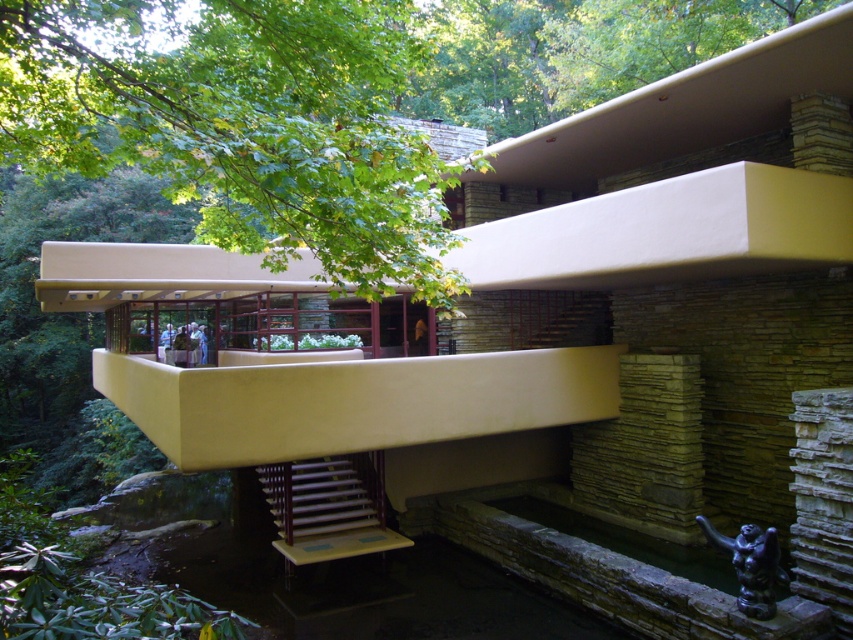
You are standing at the entrance of the building and want to take a photo of the wooden stairs at center while including the green leafy tree at upper left in the frame. Can you position yourself in a way that both objects are visible in the same shot?

Yes, since the green leafy tree at upper left is positioned over the wooden stairs at center, you can stand at the entrance and angle your camera upwards to include both the tree and the stairs in the same frame.

Consider the image. You are standing at the entrance of the modernist building and want to take a photo of the green leafy tree at upper left and the wooden stairs at center. Which object is positioned to the right side of the other?

The green leafy tree at upper left is to the right of the wooden stairs at center.

You are a maintenance worker needing to reach the wooden stairs at center from the green leafy tree at upper left. Considering the distance between them is 12.58 feet, can you walk directly from the tree to the stairs without any obstacles?

The distance between the green leafy tree at upper left and wooden stairs at center is 12.58 feet. Since there are no obstacles mentioned in the scene description, you can walk directly from the tree to the stairs.